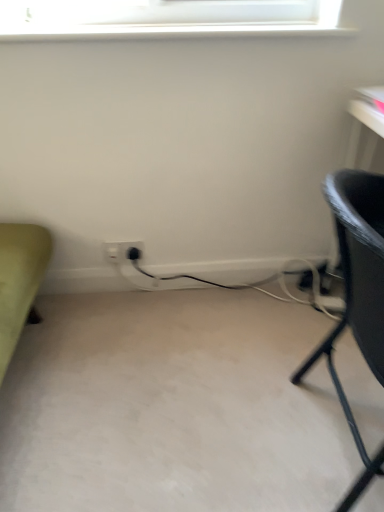
Locate an element on the screen. The height and width of the screenshot is (512, 384). white plastic electric outlet at center, which is the 1th electric outlet from left to right is located at coordinates (112, 252).

Describe the element at coordinates (122, 251) in the screenshot. The image size is (384, 512). I see `white plastic electric outlet at lower center, the 2th electric outlet positioned from the left` at that location.

I want to click on white plastic electric outlet at center, which is the 1th electric outlet from left to right, so click(x=112, y=252).

From a real-world perspective, which is physically below, white plastic electric outlet at center, arranged as the 2th electric outlet when viewed from the right, or white plastic electric outlet at lower center, positioned as the first electric outlet in right-to-left order?

white plastic electric outlet at center, arranged as the 2th electric outlet when viewed from the right.

Is white plastic electric outlet at center, which is the 1th electric outlet from left to right, in contact with white plastic electric outlet at lower center, positioned as the first electric outlet in right-to-left order?

Absolutely, white plastic electric outlet at center, which is the 1th electric outlet from left to right, is next to and touching white plastic electric outlet at lower center, positioned as the first electric outlet in right-to-left order.

What's the angular difference between white plastic electric outlet at center, arranged as the 2th electric outlet when viewed from the right, and white plastic electric outlet at lower center, the 2th electric outlet positioned from the left,'s facing directions?

The angle between the facing direction of white plastic electric outlet at center, arranged as the 2th electric outlet when viewed from the right, and the facing direction of white plastic electric outlet at lower center, the 2th electric outlet positioned from the left, is 0.00981 degrees.

Can you confirm if white plastic electric outlet at center, which is the 1th electric outlet from left to right, is positioned to the left of white plastic electric outlet at lower center, the 2th electric outlet positioned from the left?

Yes, white plastic electric outlet at center, which is the 1th electric outlet from left to right, is to the left of white plastic electric outlet at lower center, the 2th electric outlet positioned from the left.

Considering the sizes of objects black plastic plug at lower center and black textured chair at right in the image provided, who is smaller, black plastic plug at lower center or black textured chair at right?

black plastic plug at lower center.

Could you tell me if black plastic plug at lower center is turned towards black textured chair at right?

No, black plastic plug at lower center is not facing towards black textured chair at right.

The width and height of the screenshot is (384, 512). I want to click on plug behind the black textured chair at right, so click(x=134, y=253).

Looking at this image, is black plastic plug at lower center at the back of black textured chair at right?

black textured chair at right is not turned away from black plastic plug at lower center.

From a real-world perspective, is black textured chair at right positioned over black plastic plug at lower center based on gravity?

Indeed, from a real-world perspective, black textured chair at right stands above black plastic plug at lower center.

From the image's perspective, is black textured chair at right beneath black plastic plug at lower center?

Yes, from the image's perspective, black textured chair at right is beneath black plastic plug at lower center.

Is white plastic electric outlet at lower center, positioned as the first electric outlet in right-to-left order, facing towards black plastic plug at lower center?

Yes, white plastic electric outlet at lower center, positioned as the first electric outlet in right-to-left order, is turned towards black plastic plug at lower center.

Is black plastic plug at lower center a part of white plastic electric outlet at lower center, the 2th electric outlet positioned from the left?

Yes, black plastic plug at lower center is inside white plastic electric outlet at lower center, the 2th electric outlet positioned from the left.

Which object is closer to the camera, white plastic electric outlet at lower center, positioned as the first electric outlet in right-to-left order, or black plastic plug at lower center?

Positioned in front is white plastic electric outlet at lower center, positioned as the first electric outlet in right-to-left order.

Is point (123, 254) closer or farther from the camera than point (134, 258)?

Point (123, 254).

From the image's perspective, does white plastic electric outlet at lower center, positioned as the first electric outlet in right-to-left order, appear higher than black textured chair at right?

Yes, from the image's perspective, white plastic electric outlet at lower center, positioned as the first electric outlet in right-to-left order, is on top of black textured chair at right.

The height and width of the screenshot is (512, 384). I want to click on the 1st electric outlet behind the black textured chair at right, so click(x=122, y=251).

From a real-world perspective, does white plastic electric outlet at lower center, the 2th electric outlet positioned from the left, sit lower than black textured chair at right?

Correct, in the physical world, white plastic electric outlet at lower center, the 2th electric outlet positioned from the left, is lower than black textured chair at right.

Is point (139, 250) positioned in front of point (354, 284)?

No, (139, 250) is behind (354, 284).

This screenshot has width=384, height=512. What are the coordinates of `electric outlet located on the right of white plastic electric outlet at center, arranged as the 2th electric outlet when viewed from the right` in the screenshot? It's located at (122, 251).

Considering the relative positions of white plastic electric outlet at lower center, positioned as the first electric outlet in right-to-left order, and white plastic electric outlet at center, arranged as the 2th electric outlet when viewed from the right, in the image provided, is white plastic electric outlet at lower center, positioned as the first electric outlet in right-to-left order, behind white plastic electric outlet at center, arranged as the 2th electric outlet when viewed from the right,?

That is False.

From the image's perspective, is white plastic electric outlet at lower center, the 2th electric outlet positioned from the left, located beneath white plastic electric outlet at center, which is the 1th electric outlet from left to right?

No, from the image's perspective, white plastic electric outlet at lower center, the 2th electric outlet positioned from the left, is not below white plastic electric outlet at center, which is the 1th electric outlet from left to right.

Which of these two, white plastic electric outlet at lower center, the 2th electric outlet positioned from the left, or white plastic electric outlet at center, arranged as the 2th electric outlet when viewed from the right, stands taller?

white plastic electric outlet at lower center, the 2th electric outlet positioned from the left.

Is black textured chair at right completely or partially outside of white plastic electric outlet at lower center, the 2th electric outlet positioned from the left?

black textured chair at right lies outside white plastic electric outlet at lower center, the 2th electric outlet positioned from the left,'s area.

Measure the distance from black textured chair at right to white plastic electric outlet at lower center, the 2th electric outlet positioned from the left.

black textured chair at right is 34.10 inches from white plastic electric outlet at lower center, the 2th electric outlet positioned from the left.

Could you tell me if black textured chair at right is turned towards white plastic electric outlet at lower center, the 2th electric outlet positioned from the left?

No, black textured chair at right is not turned towards white plastic electric outlet at lower center, the 2th electric outlet positioned from the left.

In the scene shown: From the image's perspective, would you say black textured chair at right is positioned over white plastic electric outlet at lower center, the 2th electric outlet positioned from the left?

Incorrect, from the image's perspective, black textured chair at right is lower than white plastic electric outlet at lower center, the 2th electric outlet positioned from the left.

Locate an element on the screen. The height and width of the screenshot is (512, 384). electric outlet located behind the white plastic electric outlet at lower center, the 2th electric outlet positioned from the left is located at coordinates (112, 252).

Find the location of a particular element. chair located below the black plastic plug at lower center (from the image's perspective) is located at coordinates (358, 292).

Looking at the image, which one is located further to black textured chair at right, white plastic electric outlet at lower center, the 2th electric outlet positioned from the left, or black plastic plug at lower center?

The object further to black textured chair at right is black plastic plug at lower center.

From the image, which object appears to be nearer to black textured chair at right, white plastic electric outlet at lower center, the 2th electric outlet positioned from the left, or white plastic electric outlet at center, which is the 1th electric outlet from left to right?

white plastic electric outlet at lower center, the 2th electric outlet positioned from the left.

Considering their positions, is white plastic electric outlet at center, arranged as the 2th electric outlet when viewed from the right, positioned further to black plastic plug at lower center than white plastic electric outlet at lower center, the 2th electric outlet positioned from the left?

white plastic electric outlet at center, arranged as the 2th electric outlet when viewed from the right, is further to black plastic plug at lower center.

Considering their positions, is black plastic plug at lower center positioned further to black textured chair at right than white plastic electric outlet at lower center, positioned as the first electric outlet in right-to-left order?

Answer: black plastic plug at lower center is positioned further to the anchor black textured chair at right.

From the image, which object appears to be farther from white plastic electric outlet at center, arranged as the 2th electric outlet when viewed from the right, white plastic electric outlet at lower center, the 2th electric outlet positioned from the left, or black plastic plug at lower center?

Among the two, black plastic plug at lower center is located further to white plastic electric outlet at center, arranged as the 2th electric outlet when viewed from the right.

Estimate the real-world distances between objects in this image. Which object is closer to white plastic electric outlet at lower center, positioned as the first electric outlet in right-to-left order, black textured chair at right or white plastic electric outlet at center, arranged as the 2th electric outlet when viewed from the right?

white plastic electric outlet at center, arranged as the 2th electric outlet when viewed from the right, is closer to white plastic electric outlet at lower center, positioned as the first electric outlet in right-to-left order.

Which object lies nearer to the anchor point white plastic electric outlet at center, which is the 1th electric outlet from left to right, black textured chair at right or white plastic electric outlet at lower center, positioned as the first electric outlet in right-to-left order?

white plastic electric outlet at lower center, positioned as the first electric outlet in right-to-left order, is closer to white plastic electric outlet at center, which is the 1th electric outlet from left to right.

Estimate the real-world distances between objects in this image. Which object is closer to white plastic electric outlet at lower center, the 2th electric outlet positioned from the left, black plastic plug at lower center or black textured chair at right?

Among the two, black plastic plug at lower center is located nearer to white plastic electric outlet at lower center, the 2th electric outlet positioned from the left.

Where is `electric outlet between black textured chair at right and black plastic plug at lower center along the z-axis`? This screenshot has width=384, height=512. electric outlet between black textured chair at right and black plastic plug at lower center along the z-axis is located at coordinates click(x=122, y=251).

At what (x,y) coordinates should I click in order to perform the action: click on electric outlet located between black textured chair at right and white plastic electric outlet at center, which is the 1th electric outlet from left to right, in the depth direction. Please return your answer as a coordinate pair (x, y). The height and width of the screenshot is (512, 384). Looking at the image, I should click on (122, 251).

Image resolution: width=384 pixels, height=512 pixels. Identify the location of plug located between black textured chair at right and white plastic electric outlet at center, arranged as the 2th electric outlet when viewed from the right, in the depth direction. (134, 253).

Where is `electric outlet situated between white plastic electric outlet at center, which is the 1th electric outlet from left to right, and black plastic plug at lower center from left to right`? Image resolution: width=384 pixels, height=512 pixels. electric outlet situated between white plastic electric outlet at center, which is the 1th electric outlet from left to right, and black plastic plug at lower center from left to right is located at coordinates (122, 251).